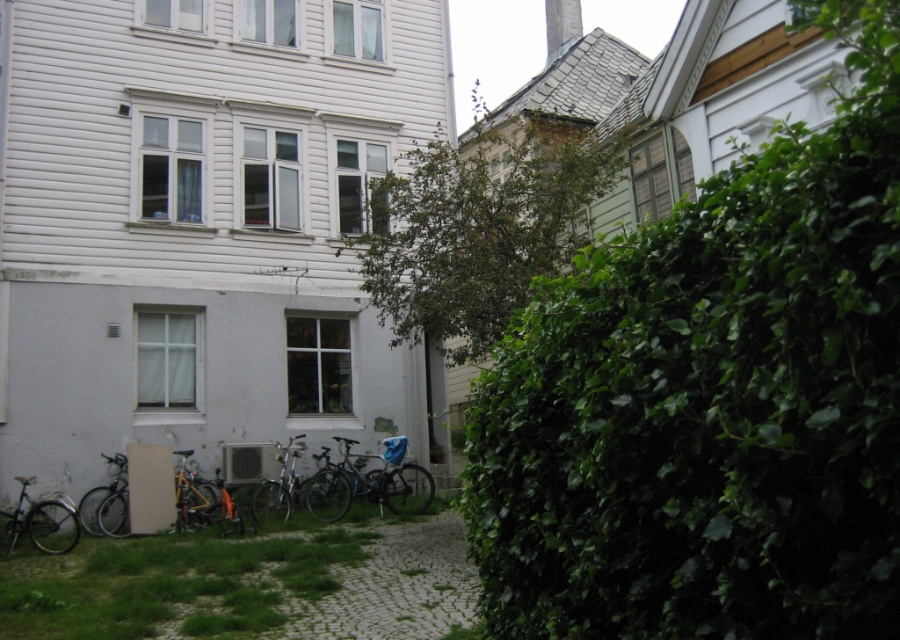
Question: Which object appears farthest from the camera in this image?

Choices:
 (A) green leafy hedge at right
 (B) silver metallic bicycle at lower left
 (C) silver metallic bicycle at center
 (D) orange matte bicycle at lower left

Answer: (D)

Question: Can you confirm if silver metallic bicycle at lower left is wider than white smooth chimney at upper center?

Choices:
 (A) yes
 (B) no

Answer: (B)

Question: Is green leafy hedge at right above silver metallic bicycle at center?

Choices:
 (A) yes
 (B) no

Answer: (A)

Question: Which of these objects is positioned farthest from the shiny silver bicycle at lower left?

Choices:
 (A) shiny blue bicycle at center
 (B) silver metallic bicycle at center
 (C) orange matte bicycle at lower left
 (D) green leafy hedge at right

Answer: (D)

Question: Which of the following is the farthest from the observer?

Choices:
 (A) silver metallic bicycle at lower left
 (B) green leafy hedge at right

Answer: (A)

Question: Can you confirm if shiny blue bicycle at center is positioned to the right of white smooth chimney at upper center?

Choices:
 (A) yes
 (B) no

Answer: (B)